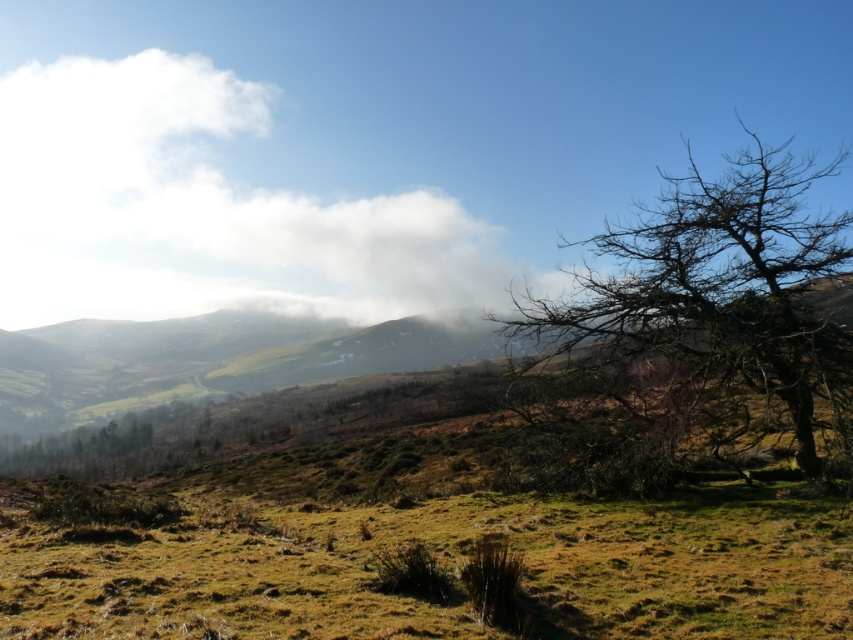
Question: Which object appears closest to the camera in this image?

Choices:
 (A) white fluffy cloud at upper left
 (B) bare branches at right

Answer: (B)

Question: Which of the following is the farthest from the observer?

Choices:
 (A) coord(457,253)
 (B) coord(590,300)

Answer: (A)

Question: Can you confirm if white fluffy cloud at upper left is positioned below bare branches at right?

Choices:
 (A) no
 (B) yes

Answer: (A)

Question: Which object is closer to the camera taking this photo?

Choices:
 (A) white fluffy cloud at upper left
 (B) bare branches at right

Answer: (B)

Question: Is white fluffy cloud at upper left to the right of bare branches at right from the viewer's perspective?

Choices:
 (A) no
 (B) yes

Answer: (A)

Question: Considering the relative positions of white fluffy cloud at upper left and bare branches at right in the image provided, where is white fluffy cloud at upper left located with respect to bare branches at right?

Choices:
 (A) right
 (B) left

Answer: (B)